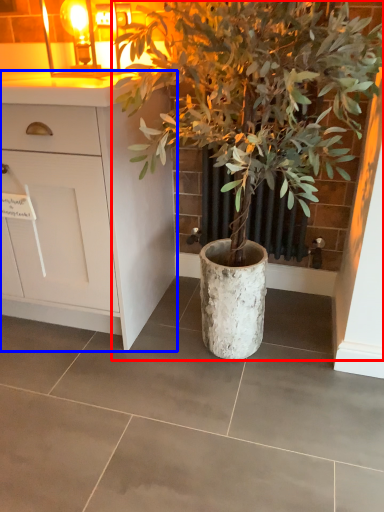
Question: Which point is further to the camera, houseplant (highlighted by a red box) or cabinetry (highlighted by a blue box)?

Choices:
 (A) houseplant
 (B) cabinetry

Answer: (B)